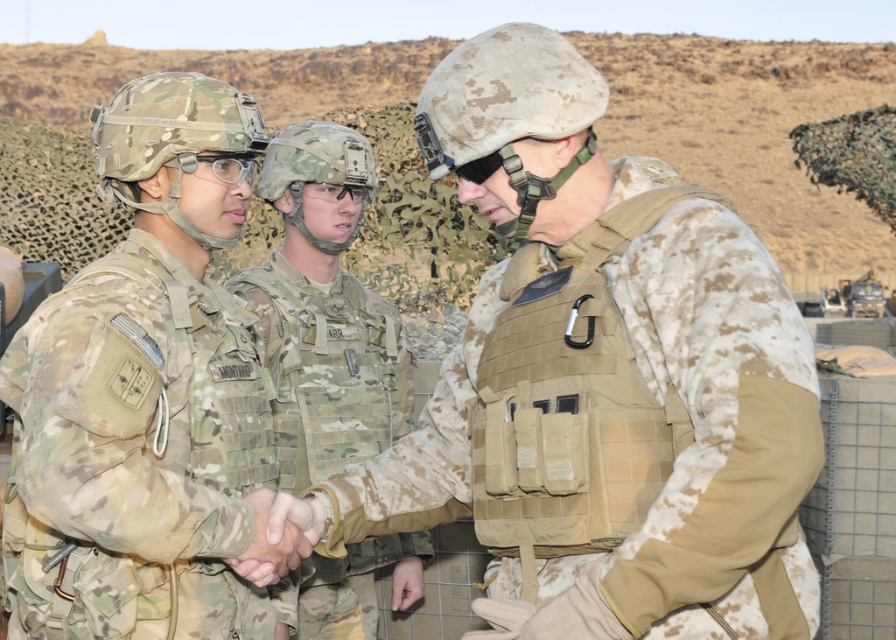
You are a drone operator observing the scene. You need to mark a point at coordinates point (136, 452). Where exactly would this point be located on the image?

The point (136, 452) is located on the camouflage fabric uniform at center.

You are a photographer trying to capture a clear shot of the camouflage fabric vest at center and the camouflage fabric uniform at center. Since both are in the same area, which one is positioned higher up?

The camouflage fabric vest at center is located above camouflage fabric uniform at center, so it is positioned higher up.

Consider the image. You are a photographer positioned at the back of the scene. You need to take a photo that includes both the camouflage fabric uniform at center and the multicam fabric uniform at center. Which uniform will appear larger in the photo?

The camouflage fabric uniform at center will appear larger in the photo because it is closer to the viewer than the multicam fabric uniform at center.